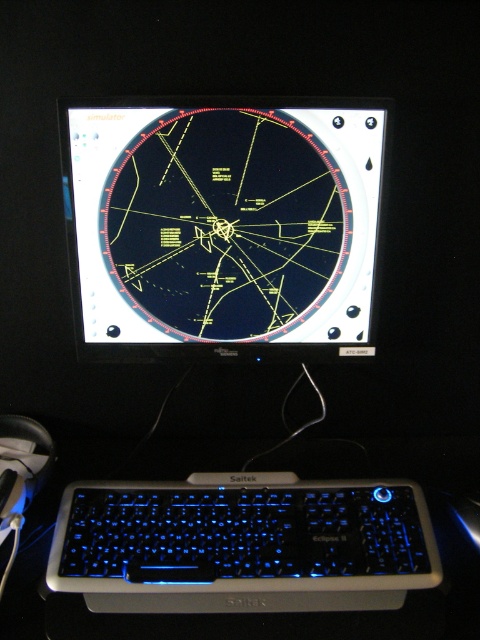
You are a flight simulator enthusiast who wants to place a 12.5 cm wide decorative model airplane between the point at coordinates point (252,602) and the edge of the monitor. Will the model airplane fit in that space?

The distance between the point at coordinates point (252,602) and the edge of the monitor is 30.41 inches. Converting 30.41 inches to centimeters gives approximately 77.24 cm. Since the model airplane is only 12.5 cm wide, there is more than enough space to place it between the point and the monitor edge.

You are a pilot trainee sitting in a flight simulator. Your instructor asks you to reach for the black glossy monitor at center to adjust its settings. Considering your current seated position, can you comfortably reach the monitor without leaving your seat?

The black glossy monitor at center is 34.55 inches away from the viewer, so yes, you can comfortably reach it without leaving your seat since it is within a typical arm reach distance.